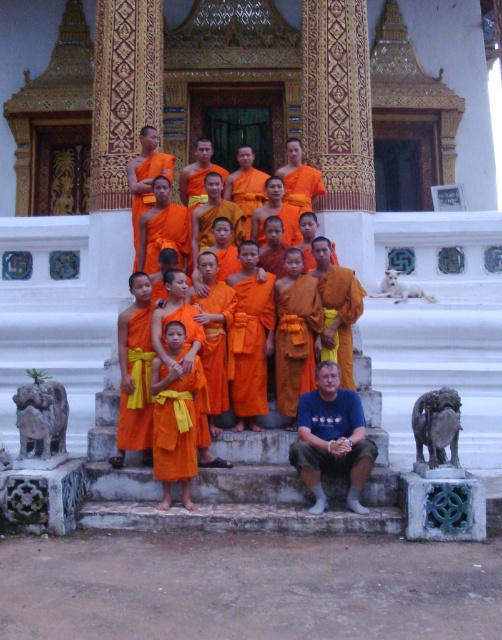
You are a photographer adjusting your camera settings to capture the orange cloth at center in this temple scene. The camera has a focus point at coordinate point (293, 250). Is this focus point correctly positioned to capture the orange cloth at center?

Yes, the point (293, 250) is where the orange cloth at center is located, so the focus point is correctly positioned to capture it.